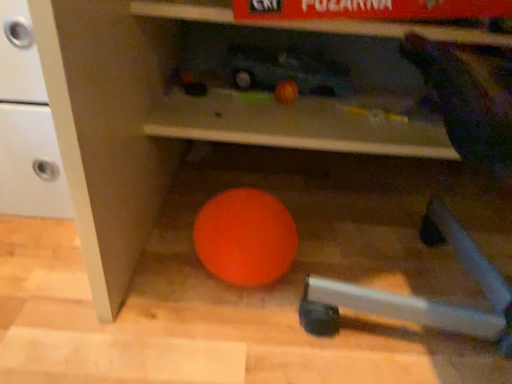
The image size is (512, 384). In order to click on orange rubber ball at center in this screenshot , I will do `click(245, 237)`.

What do you see at coordinates (245, 237) in the screenshot?
I see `orange rubber ball at center` at bounding box center [245, 237].

Describe the element at coordinates (418, 299) in the screenshot. I see `orange matte bean bag chair at lower left` at that location.

Image resolution: width=512 pixels, height=384 pixels. In order to click on orange matte bean bag chair at lower left in this screenshot , I will do `click(418, 299)`.

Find the location of a particular element. This screenshot has height=384, width=512. orange rubber ball at center is located at coordinates (245, 237).

Considering the relative positions of orange rubber ball at center and orange matte bean bag chair at lower left in the image provided, is orange rubber ball at center to the left of orange matte bean bag chair at lower left from the viewer's perspective?

Yes.

Which object is closer to the camera, orange rubber ball at center or orange matte bean bag chair at lower left?

orange matte bean bag chair at lower left.

Is point (282, 221) behind point (446, 48)?

Yes, it is behind point (446, 48).

From the image's perspective, which one is positioned higher, orange rubber ball at center or orange matte bean bag chair at lower left?

orange matte bean bag chair at lower left is shown above in the image.

From a real-world perspective, who is located lower, orange rubber ball at center or orange matte bean bag chair at lower left?

orange rubber ball at center is physically lower.

Looking at their sizes, would you say orange rubber ball at center is wider or thinner than orange matte bean bag chair at lower left?

In the image, orange rubber ball at center appears to be more narrow than orange matte bean bag chair at lower left.

From their relative heights in the image, would you say orange rubber ball at center is taller or shorter than orange matte bean bag chair at lower left?

Clearly, orange rubber ball at center is shorter compared to orange matte bean bag chair at lower left.

Which of these two, orange rubber ball at center or orange matte bean bag chair at lower left, is smaller?

orange rubber ball at center.

Is orange rubber ball at center spatially inside orange matte bean bag chair at lower left, or outside of it?

orange rubber ball at center is not enclosed by orange matte bean bag chair at lower left.

Would you consider orange rubber ball at center to be distant from orange matte bean bag chair at lower left?

No, orange rubber ball at center is in close proximity to orange matte bean bag chair at lower left.

Is orange rubber ball at center facing towards orange matte bean bag chair at lower left?

Yes, orange rubber ball at center is oriented towards orange matte bean bag chair at lower left.

Can you tell me how much orange rubber ball at center and orange matte bean bag chair at lower left differ in facing direction?

The facing directions of orange rubber ball at center and orange matte bean bag chair at lower left are 162 degrees apart.

In order to click on bean bag chair above the orange rubber ball at center (from the image's perspective) in this screenshot , I will do `click(418, 299)`.

In the scene shown: Is orange matte bean bag chair at lower left to the left of orange rubber ball at center from the viewer's perspective?

No, orange matte bean bag chair at lower left is not to the left of orange rubber ball at center.

Which is behind, orange matte bean bag chair at lower left or orange rubber ball at center?

orange rubber ball at center is more distant.

Between point (464, 260) and point (241, 190), which one is positioned behind?

Positioned behind is point (464, 260).

From the image's perspective, is orange matte bean bag chair at lower left below orange rubber ball at center?

Incorrect, from the image's perspective, orange matte bean bag chair at lower left is higher than orange rubber ball at center.

From a real-world perspective, relative to orange rubber ball at center, is orange matte bean bag chair at lower left vertically above or below?

orange matte bean bag chair at lower left is above orange rubber ball at center.

Considering the relative sizes of orange matte bean bag chair at lower left and orange rubber ball at center in the image provided, is orange matte bean bag chair at lower left wider than orange rubber ball at center?

Yes.

Which of these two, orange matte bean bag chair at lower left or orange rubber ball at center, stands taller?

orange matte bean bag chair at lower left is taller.

Which of these two, orange matte bean bag chair at lower left or orange rubber ball at center, is bigger?

orange matte bean bag chair at lower left.

Would you say orange matte bean bag chair at lower left is outside orange rubber ball at center?

orange matte bean bag chair at lower left is positioned outside orange rubber ball at center.

Are orange matte bean bag chair at lower left and orange rubber ball at center beside each other?

There is a gap between orange matte bean bag chair at lower left and orange rubber ball at center.

Is orange matte bean bag chair at lower left facing towards orange rubber ball at center?

No, orange matte bean bag chair at lower left is not oriented towards orange rubber ball at center.

How many degrees apart are the facing directions of orange matte bean bag chair at lower left and orange rubber ball at center?

There is a 162-degree angle between the facing directions of orange matte bean bag chair at lower left and orange rubber ball at center.

This screenshot has height=384, width=512. In order to click on bean bag chair located above the orange rubber ball at center (from the image's perspective) in this screenshot , I will do `click(418, 299)`.

Identify the location of ball below the orange matte bean bag chair at lower left (from the image's perspective). (245, 237).

This screenshot has width=512, height=384. What are the coordinates of `ball located behind the orange matte bean bag chair at lower left` in the screenshot? It's located at (245, 237).